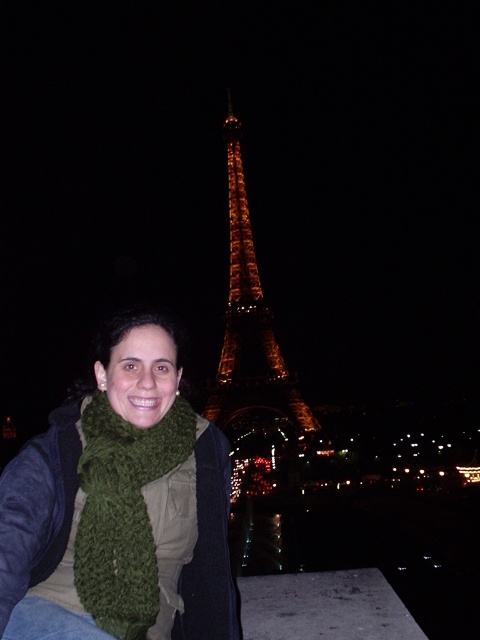
You are standing in front of the Eiffel Tower at night and see the green knitted scarf at center. If you want to take a photo of the scarf with the Eiffel Tower in the background, will you need to zoom in or out?

The green knitted scarf at center is 143.31 meters away from the viewer. Since the scarf is far away, you will need to zoom in to capture it clearly with the Eiffel Tower in the background.

You are a photographer trying to capture the illuminated glass Eiffel Tower at center in the background. However, the green knitted scarf at lower left is blocking your view. Can you determine if the scarf is closer to you than the tower?

The green knitted scarf at lower left is further to the viewer than illuminated glass eiffel tower at center, so yes, the scarf is closer to you and blocking the view of the tower.